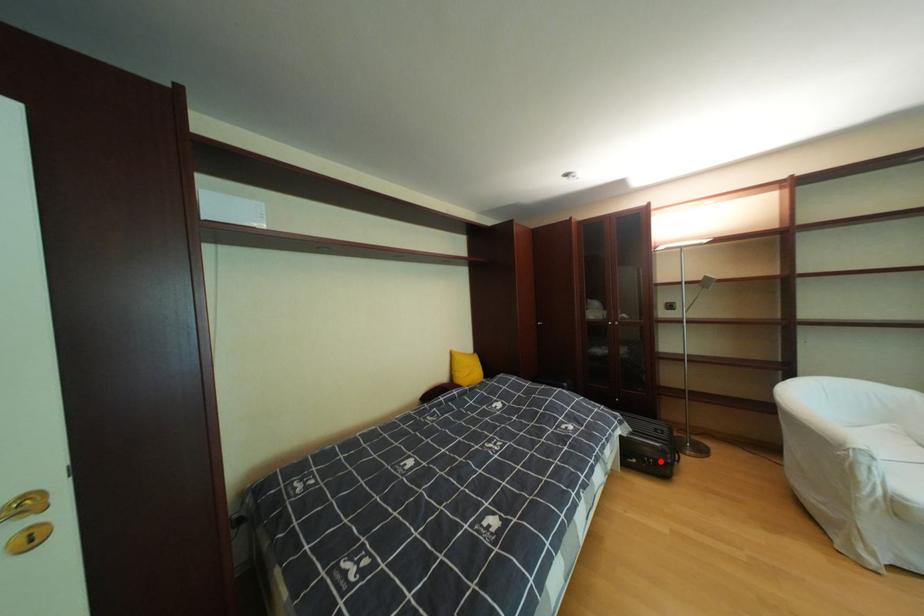
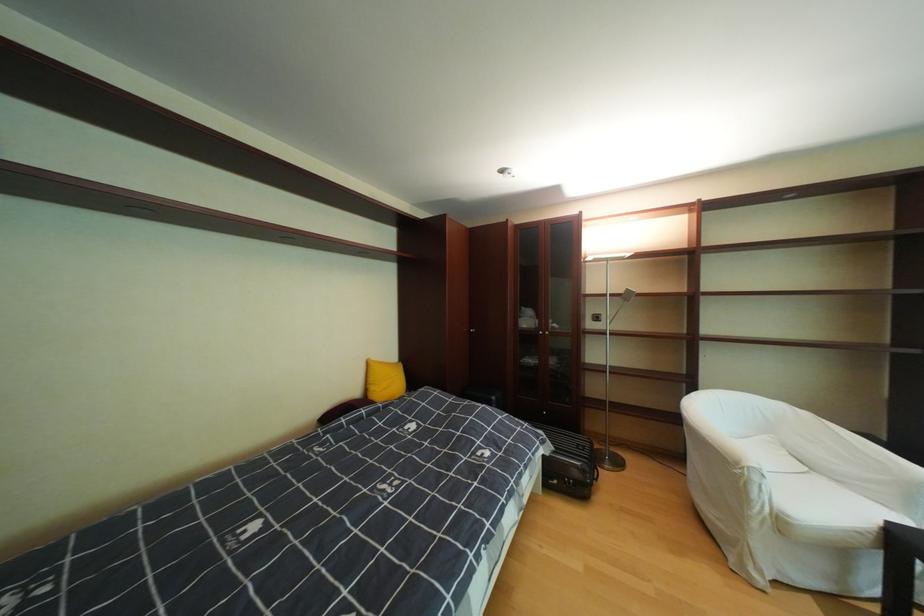
Locate, in the second image, the point that corresponds to the highlighted location in the first image.

(580, 483)